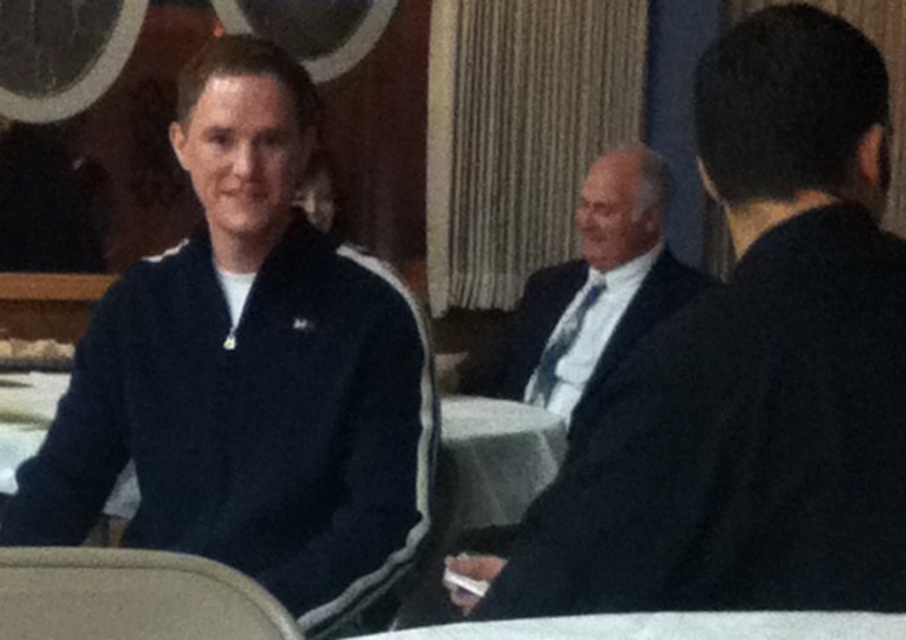
Question: Is dark blue suit at center smaller than beige fabric chair at lower left?

Choices:
 (A) no
 (B) yes

Answer: (A)

Question: Which point is farther to the camera?

Choices:
 (A) (524, 388)
 (B) (815, 484)
 (C) (223, 276)
 (D) (166, 588)

Answer: (A)

Question: Which object appears closest to the camera in this image?

Choices:
 (A) beige fabric chair at lower left
 (B) navy blue jacket at left

Answer: (A)

Question: Observing the image, what is the correct spatial positioning of navy blue jacket at left in reference to dark blue suit at center?

Choices:
 (A) above
 (B) below

Answer: (A)

Question: Estimate the real-world distances between objects in this image. Which object is farther from the beige fabric chair at lower left?

Choices:
 (A) navy blue jacket at left
 (B) dark blue suit at center

Answer: (B)

Question: Is navy blue jacket at left thinner than beige fabric chair at lower left?

Choices:
 (A) no
 (B) yes

Answer: (A)